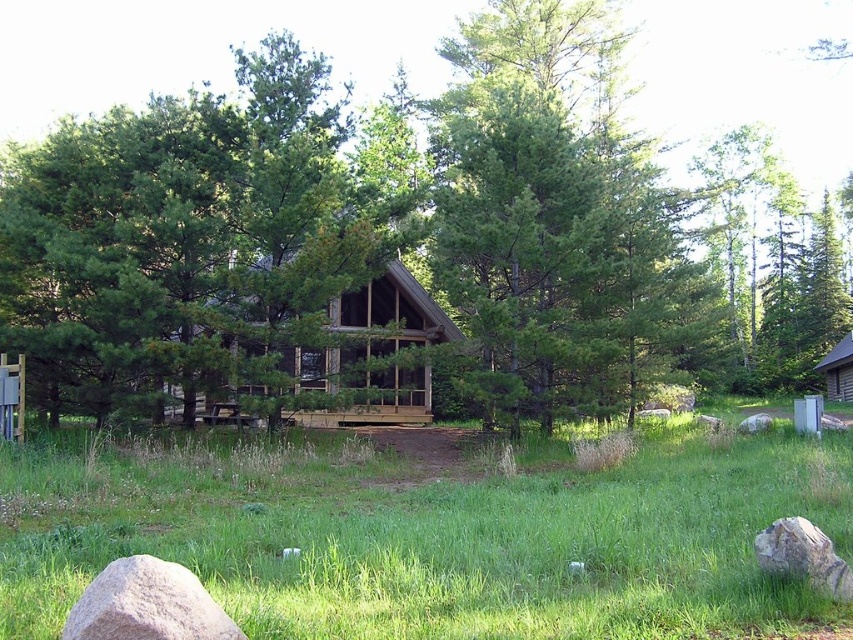
You are standing at the point marked by the coordinate point (370, 355) in the image. What structure are you currently at?

The point (370, 355) indicates the wooden cabin at center.

Consider the image. You are standing at the point closest to the camera in the image. Which point, point (381, 330) or point (788, 544), is farther away from you?

Point (381, 330) is behind point (788, 544), so it is farther away from you.

You are standing at the gray rough rock at lower left and want to reach the wooden cabin at center. Which direction should you move to get there?

You should move to the right to reach the wooden cabin at center because it is located to the left of the gray rough rock at lower left, meaning the cabin is on the right side from the rock.